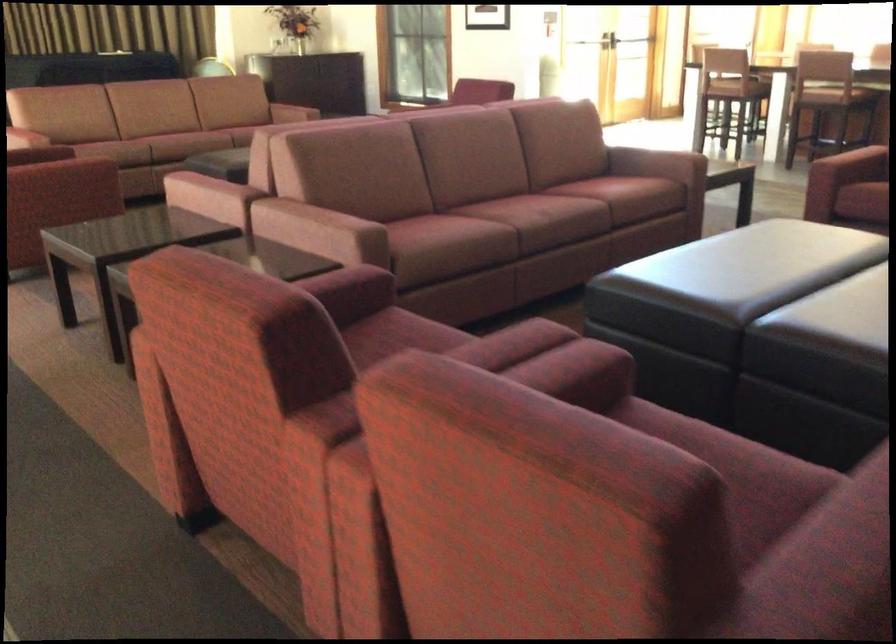
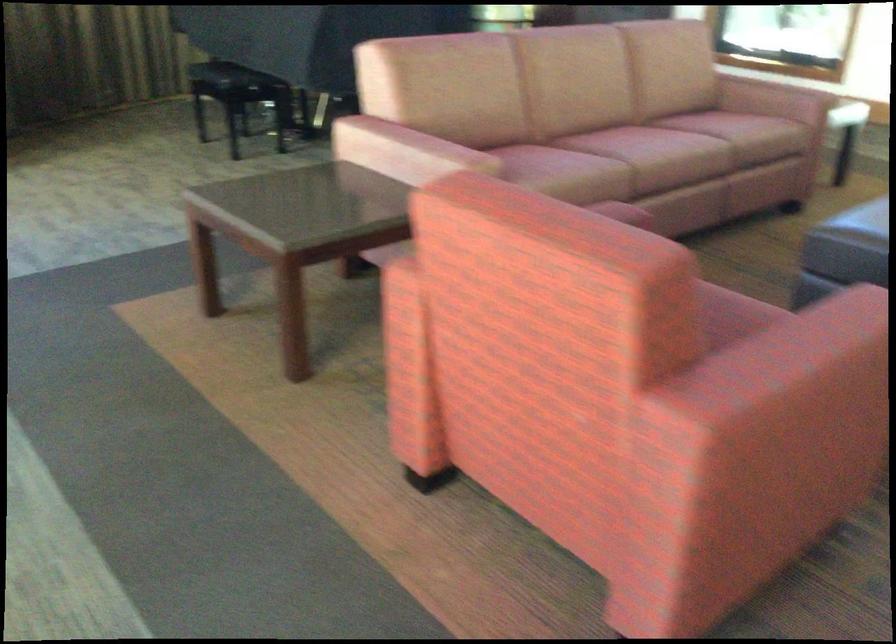
Consider the image. Which direction would the cameraman need to move to produce the second image?

The cameraman moved toward left, forward.